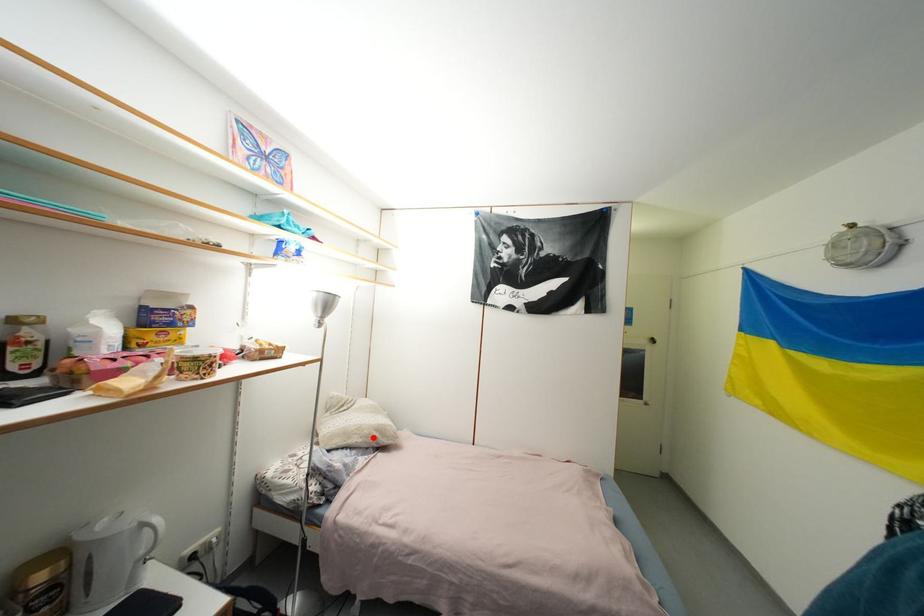
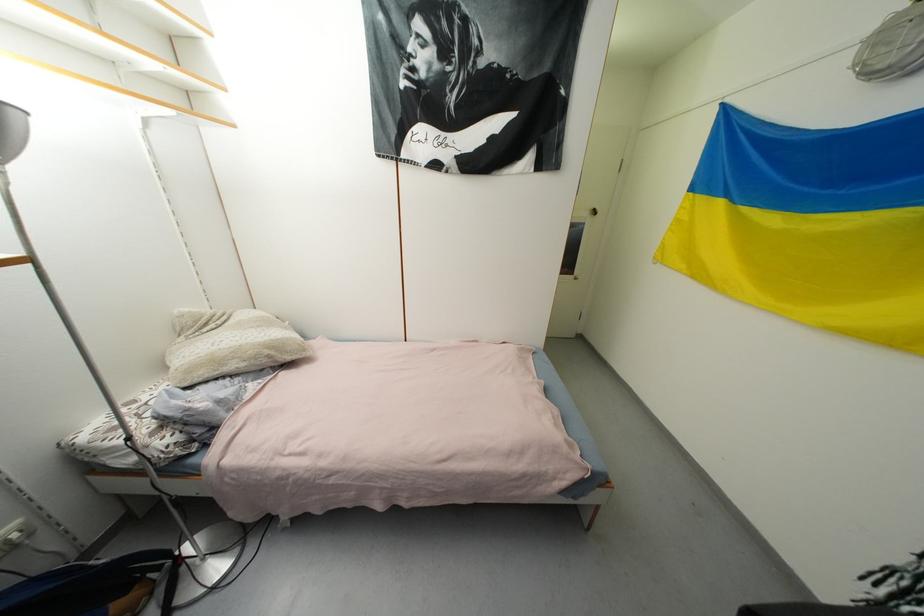
Find the pixel in the second image that matches the highlighted location in the first image.

(261, 359)